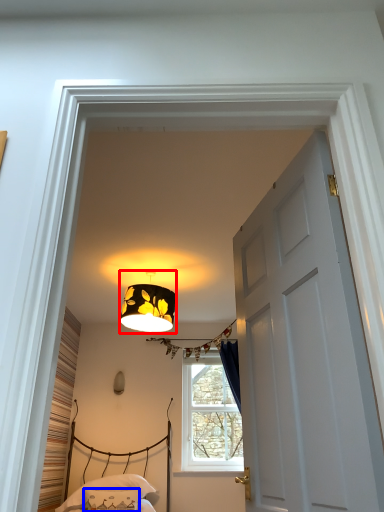
Question: Which object is further to the camera taking this photo, lamp (highlighted by a red box) or pillow (highlighted by a blue box)?

Choices:
 (A) lamp
 (B) pillow

Answer: (B)